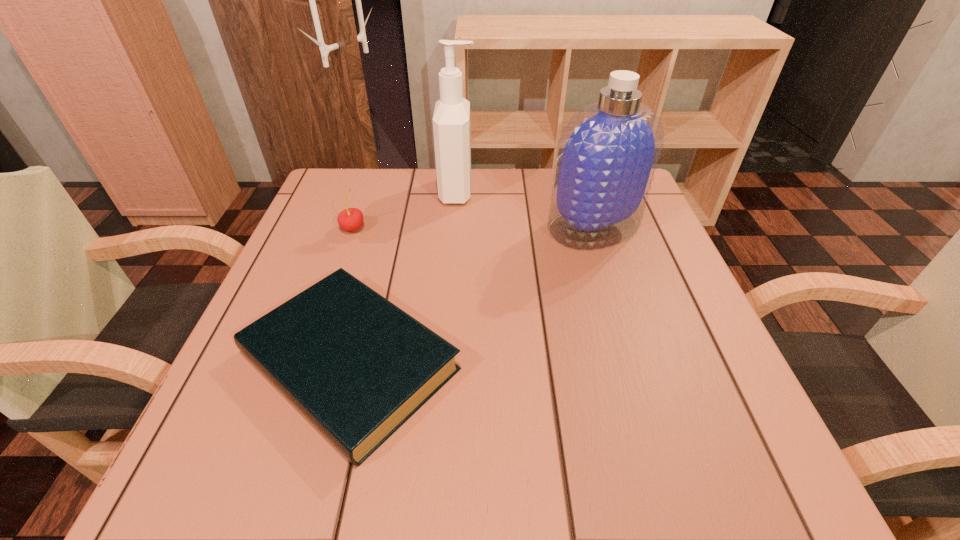
The image size is (960, 540). I want to click on free point at the far left corner, so (326, 181).

The width and height of the screenshot is (960, 540). I want to click on free space between the cherry and the left cleansing agent, so click(x=405, y=210).

Locate an element on the screen. The width and height of the screenshot is (960, 540). vacant area between the left cleansing agent and the shortest object is located at coordinates (403, 276).

The image size is (960, 540). I want to click on unoccupied area between the rightmost object and the third tallest object, so click(x=473, y=227).

Identify the location of blank region between the left cleansing agent and the shortest object. (403, 276).

The height and width of the screenshot is (540, 960). I want to click on vacant point located between the right cleansing agent and the shortest object, so pos(471,294).

At what (x,y) coordinates should I click in order to perform the action: click on free spot between the right cleansing agent and the shortest object. Please return your answer as a coordinate pair (x, y). Looking at the image, I should click on (471, 294).

Where is `free space between the left cleansing agent and the rightmost object`? free space between the left cleansing agent and the rightmost object is located at coordinates (525, 209).

Find the location of a particular element. The height and width of the screenshot is (540, 960). vacant area that lies between the nearest object and the left cleansing agent is located at coordinates pyautogui.click(x=403, y=276).

Identify the location of the second closest object to the book. Image resolution: width=960 pixels, height=540 pixels. (607, 154).